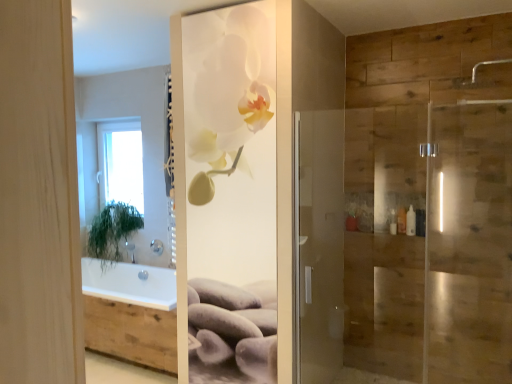
What do you see at coordinates (112, 232) in the screenshot? I see `green leafy plant at left` at bounding box center [112, 232].

In order to click on white plastic bottle at right in this screenshot , I will do `click(411, 221)`.

Locate an element on the screen. silver metallic shower head at upper right, which appears as the 2th shower when ordered from the bottom is located at coordinates (483, 65).

What do you see at coordinates (228, 92) in the screenshot? I see `white glossy orchid at center` at bounding box center [228, 92].

Locate an element on the screen. The width and height of the screenshot is (512, 384). white glass window at upper left is located at coordinates (120, 164).

Is green leafy plant at left inside or outside of white plastic bottle at right?

green leafy plant at left is spatially situated outside white plastic bottle at right.

Is green leafy plant at left at the right side of white plastic bottle at right?

No.

Is green leafy plant at left positioned with its back to white plastic bottle at right?

That's not correct — green leafy plant at left is not looking away from white plastic bottle at right.

Considering the positions of objects green leafy plant at left and white plastic bottle at right in the image provided, who is in front, green leafy plant at left or white plastic bottle at right?

white plastic bottle at right is in front.

Is point (407, 233) less distant than point (216, 128)?

Yes.

Is white plastic bottle at right shorter than white glossy orchid at center?

Indeed, white plastic bottle at right has a lesser height compared to white glossy orchid at center.

From the image's perspective, which is below, white plastic bottle at right or white glossy orchid at center?

white plastic bottle at right appears lower in the image.

Based on the photo, who is bigger, white plastic bottle at right or white glossy orchid at center?

white glossy orchid at center.

Who is bigger, green leafy plant at left or white glossy orchid at center?

green leafy plant at left.

Is green leafy plant at left not near white glossy orchid at center?

Yes, green leafy plant at left and white glossy orchid at center are located far from each other.

Based on the photo, could you tell me if green leafy plant at left is facing white glossy orchid at center?

No, green leafy plant at left is not facing towards white glossy orchid at center.

From the image's perspective, which one is positioned lower, green leafy plant at left or white glossy orchid at center?

green leafy plant at left appears lower in the image.

Is silver metallic shower head at upper right, placed as the 1th shower when sorted from top to bottom, looking in the opposite direction of white plastic bottle at right?

silver metallic shower head at upper right, placed as the 1th shower when sorted from top to bottom, does not have its back to white plastic bottle at right.

Is point (508, 59) closer or farther from the camera than point (409, 224)?

Point (508, 59) is positioned farther from the camera compared to point (409, 224).

Could you measure the distance between silver metallic shower head at upper right, which appears as the 2th shower when ordered from the bottom, and white plastic bottle at right?

A distance of 38.77 inches exists between silver metallic shower head at upper right, which appears as the 2th shower when ordered from the bottom, and white plastic bottle at right.

From a real-world perspective, is silver metallic shower head at upper right, which appears as the 2th shower when ordered from the bottom, physically located above or below white plastic bottle at right?

In terms of real-world spatial position, silver metallic shower head at upper right, which appears as the 2th shower when ordered from the bottom, is above white plastic bottle at right.

Can you confirm if white glossy orchid at center is thinner than silver metallic shower head at upper right, positioned as the 1th shower in front-to-back order?

Correct, the width of white glossy orchid at center is less than that of silver metallic shower head at upper right, positioned as the 1th shower in front-to-back order.

Which object is further away from the camera taking this photo, white glossy orchid at center or silver metallic shower head at upper right, which is the 2th shower in left-to-right order?

white glossy orchid at center.

Is white glossy orchid at center situated inside silver metallic shower head at upper right, positioned as the 1th shower in front-to-back order, or outside?

white glossy orchid at center is spatially situated outside silver metallic shower head at upper right, positioned as the 1th shower in front-to-back order.

Which is nearer, (261, 103) or (476, 72)?

Positioned in front is point (476, 72).

Which of these two, white glass window at upper left or silver metallic shower head at upper right, placed as the 1th shower when sorted from top to bottom, is wider?

silver metallic shower head at upper right, placed as the 1th shower when sorted from top to bottom.

Does white glass window at upper left have a lesser height compared to silver metallic shower head at upper right, which appears as the 2th shower when ordered from the bottom?

No.

Are white glass window at upper left and silver metallic shower head at upper right, which is the 2th shower in back-to-front order, located far from each other?

Absolutely, white glass window at upper left is distant from silver metallic shower head at upper right, which is the 2th shower in back-to-front order.

How distant is white glass window at upper left from silver metallic shower head at upper right, which is the 2th shower in left-to-right order?

white glass window at upper left and silver metallic shower head at upper right, which is the 2th shower in left-to-right order, are 3.40 meters apart from each other.

Between white plastic bottle at right and satin nickel showerhead at upper center, the 2th shower viewed from the right, which one appears on the left side from the viewer's perspective?

Positioned to the left is satin nickel showerhead at upper center, the 2th shower viewed from the right.

From a real-world perspective, is white plastic bottle at right physically located above or below satin nickel showerhead at upper center, which is the second shower from front to back?

white plastic bottle at right is situated higher than satin nickel showerhead at upper center, which is the second shower from front to back, in the real world.

Where is `shower located behind the white plastic bottle at right`? The image size is (512, 384). shower located behind the white plastic bottle at right is located at coordinates (157, 246).

Considering the sizes of objects white plastic bottle at right and satin nickel showerhead at upper center, the 1th shower in the bottom-to-top sequence, in the image provided, who is smaller, white plastic bottle at right or satin nickel showerhead at upper center, the 1th shower in the bottom-to-top sequence,?

Smaller between the two is white plastic bottle at right.

In the image, there is a green leafy plant at left. In order to click on toiletry above it (from the image's perspective) in this screenshot , I will do `click(411, 221)`.

The image size is (512, 384). In order to click on toiletry behind the white glossy orchid at center in this screenshot , I will do `click(411, 221)`.

From the image, which object appears to be farther from silver metallic shower head at upper right, which appears as the 2th shower when ordered from the bottom, white glass window at upper left or white glossy orchid at center?

white glass window at upper left is further to silver metallic shower head at upper right, which appears as the 2th shower when ordered from the bottom.

Considering their positions, is white glossy orchid at center positioned further to white plastic bottle at right than white glass window at upper left?

white glass window at upper left lies further to white plastic bottle at right than the other object.

Which object lies further to the anchor point white plastic bottle at right, white glass window at upper left or white glossy orchid at center?

Among the two, white glass window at upper left is located further to white plastic bottle at right.

When comparing their distances from white plastic bottle at right, does white glossy orchid at center or silver metallic shower head at upper right, placed as the 1th shower when sorted from top to bottom, seem further?

white glossy orchid at center is positioned further to the anchor white plastic bottle at right.

Based on their spatial positions, is green leafy plant at left or silver metallic shower head at upper right, which is the 2th shower in back-to-front order, closer to white plastic bottle at right?

Based on the image, silver metallic shower head at upper right, which is the 2th shower in back-to-front order, appears to be nearer to white plastic bottle at right.

Based on their spatial positions, is white glass window at upper left or green leafy plant at left further from white plastic bottle at right?

white glass window at upper left.

Estimate the real-world distances between objects in this image. Which object is further from silver metallic shower head at upper right, which is the 2th shower in left-to-right order, satin nickel showerhead at upper center, the 1th shower in the bottom-to-top sequence, or white plastic bottle at right?

satin nickel showerhead at upper center, the 1th shower in the bottom-to-top sequence, is further to silver metallic shower head at upper right, which is the 2th shower in left-to-right order.

Which object lies further to the anchor point silver metallic shower head at upper right, which appears as the 2th shower when ordered from the bottom, green leafy plant at left or white glossy orchid at center?

Based on the image, green leafy plant at left appears to be further to silver metallic shower head at upper right, which appears as the 2th shower when ordered from the bottom.

Where is `window between green leafy plant at left and white plastic bottle at right in the horizontal direction`? The image size is (512, 384). window between green leafy plant at left and white plastic bottle at right in the horizontal direction is located at coordinates (120, 164).

I want to click on shower between green leafy plant at left and white plastic bottle at right, so click(157, 246).

In order to click on floral arrangement situated between white glass window at upper left and silver metallic shower head at upper right, placed as the 1th shower when sorted from top to bottom, from left to right in this screenshot , I will do `click(228, 92)`.

Identify the location of toiletry located between green leafy plant at left and silver metallic shower head at upper right, which is the 2th shower in back-to-front order, in the left-right direction. The width and height of the screenshot is (512, 384). (411, 221).